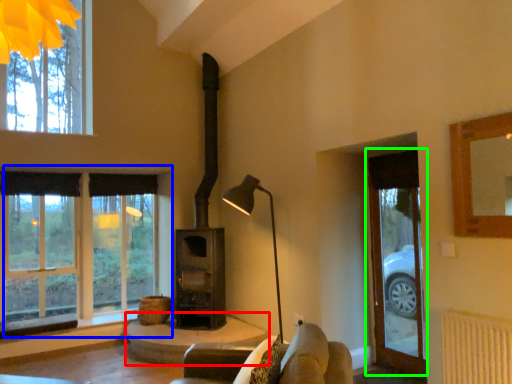
Question: Estimate the real-world distances between objects in this image. Which object is farther from table (highlighted by a red box), window (highlighted by a blue box) or glass door (highlighted by a green box)?

Choices:
 (A) window
 (B) glass door

Answer: (B)